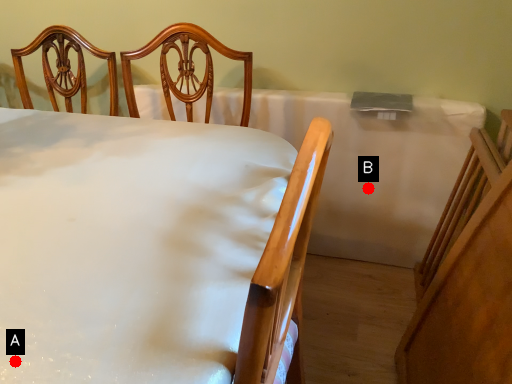
Question: Two points are circled on the image, labeled by A and B beside each circle. Among these points, which one is farthest from the camera?

Choices:
 (A) A is further
 (B) B is further

Answer: (B)